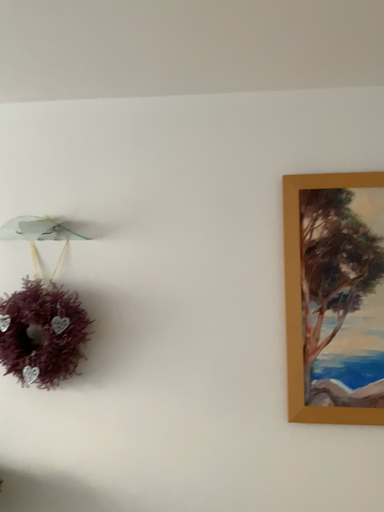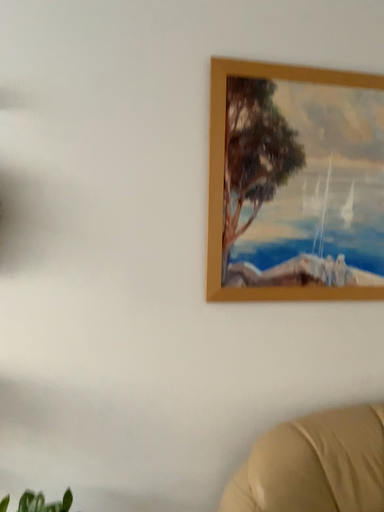
Question: Which way did the camera rotate in the video?

Choices:
 (A) rotated downward
 (B) rotated upward

Answer: (A)